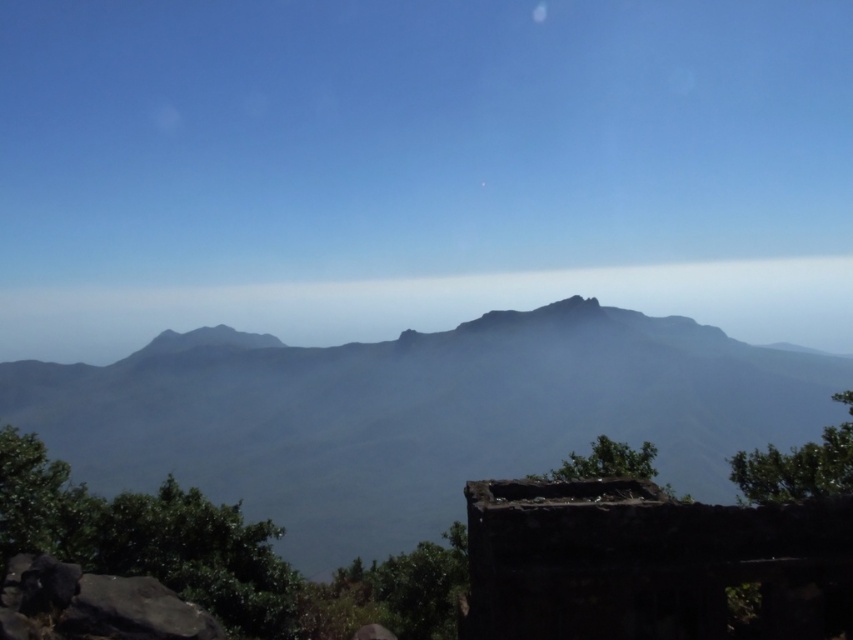
You are an explorer trying to cross the mountains. You have a map that shows the dark green textured mountain range at center and the gray matte mountain at center. Which mountain has a narrower width according to the map?

The dark green textured mountain range at center has a narrower width compared to the gray matte mountain at center.

You are an explorer trying to navigate through the mountainous landscape. You see the dark green textured mountain range at center and the gray matte mountain at center. Which mountain is positioned to the left when viewed from your current perspective?

The dark green textured mountain range at center is positioned to the left of the gray matte mountain at center.